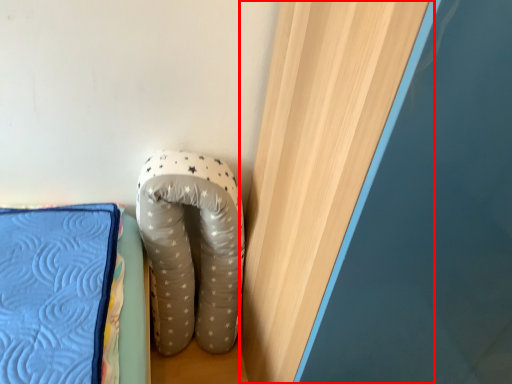
Question: From the image's perspective, what is the correct spatial relationship of curtain (annotated by the red box) in relation to footwear?

Choices:
 (A) below
 (B) above

Answer: (B)